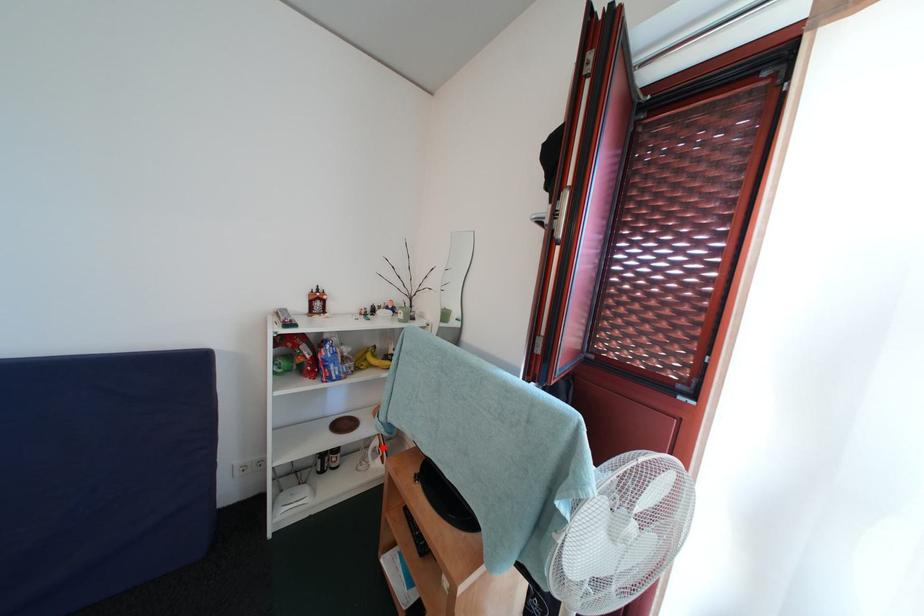
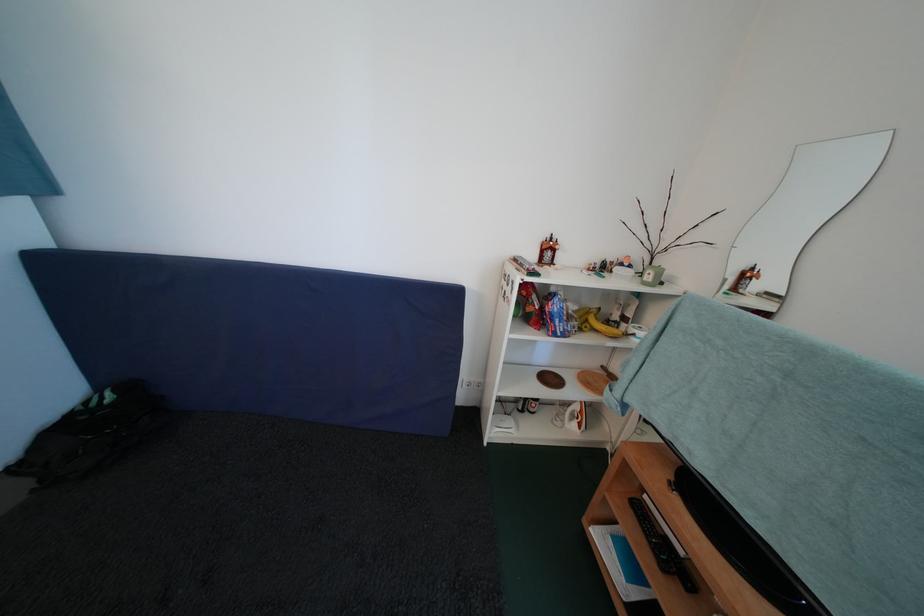
In the second image, find the point that corresponds to the highlighted location in the first image.

(584, 411)